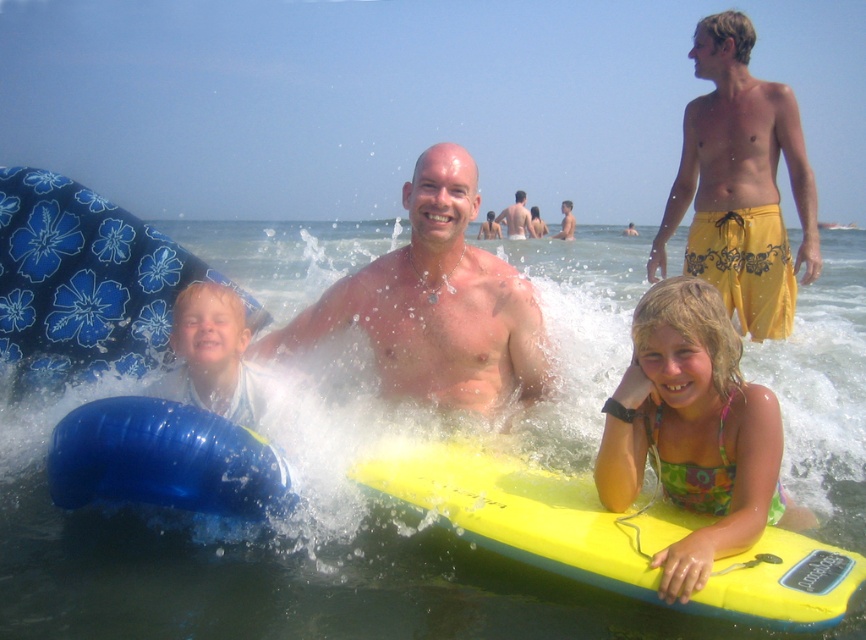
Based on the photo, you are a photographer trying to capture the surfboard and shorts in the same frame. Since the yellow foam surfboard at center is shorter than the yellow cotton shorts at upper right, will you need to adjust your camera angle to include both?

The yellow foam surfboard at center has a lesser height compared to the yellow cotton shorts at upper right. To include both in the frame, you may need to adjust your camera angle to account for their different heights.

You are a photographer trying to capture the yellow foam surfboard at center and the smooth tan skin at center in a single shot. Which object will appear larger in your photo?

The yellow foam surfboard at center will appear larger in the photo because it is closer to the viewer than the smooth tan skin at center.